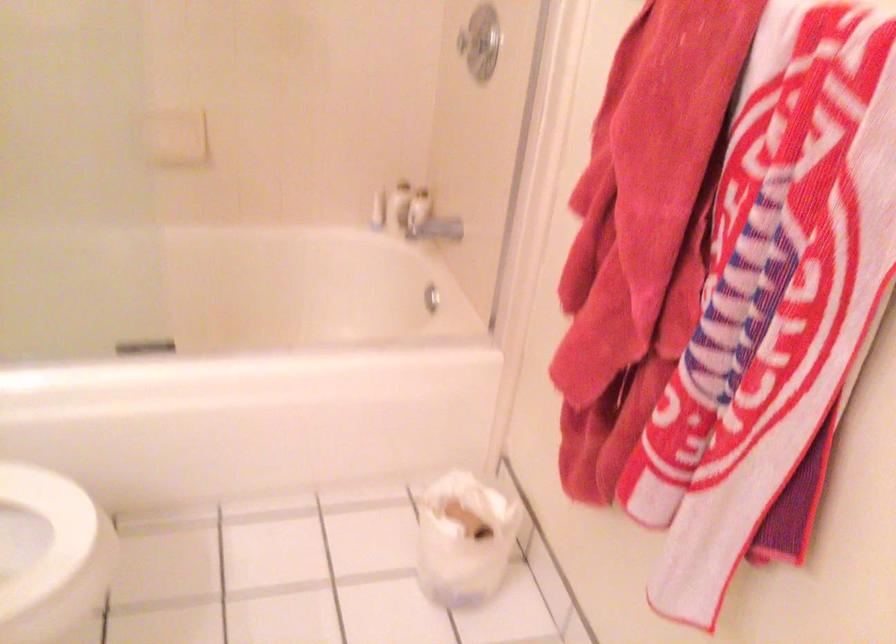
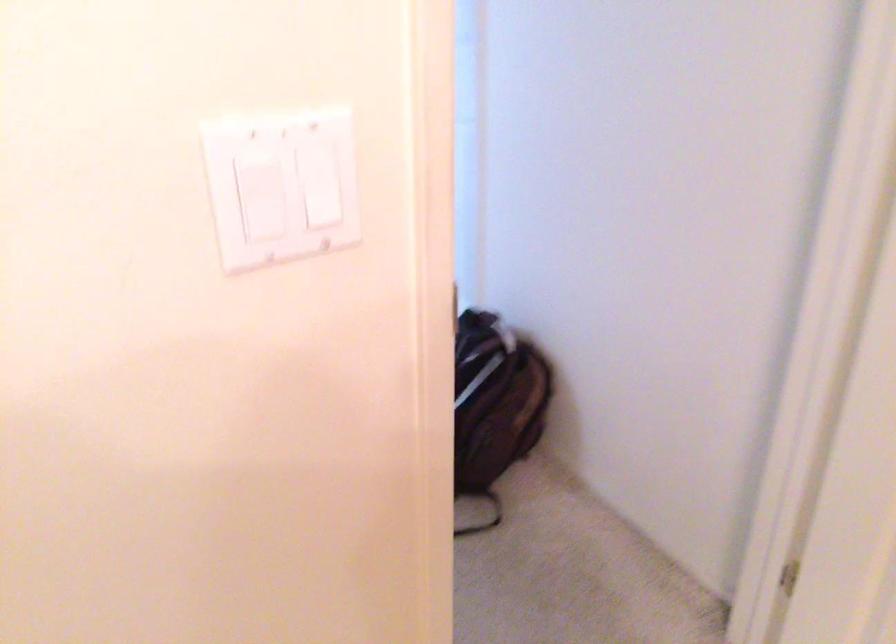
How did the camera likely rotate?

The camera's rotation is toward right-down.